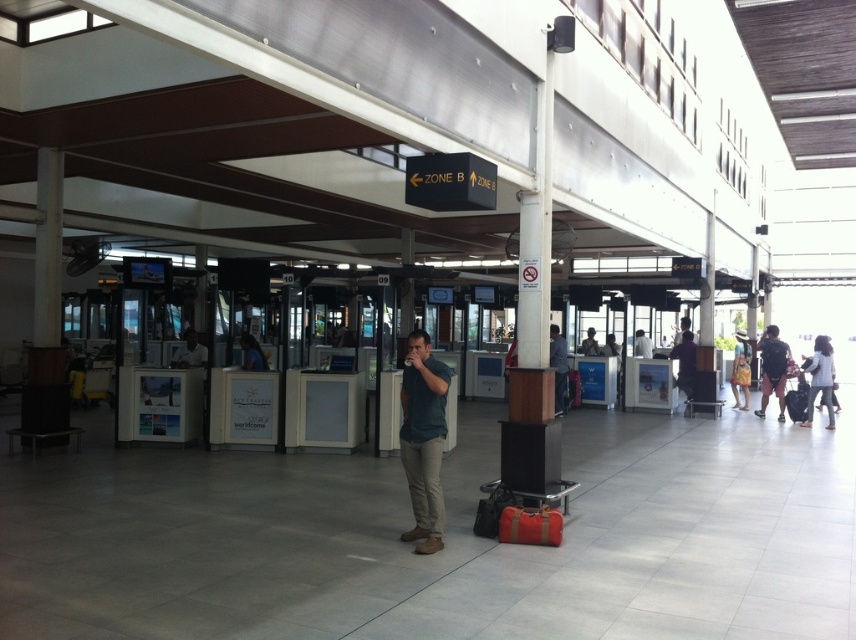
Question: Can you confirm if dark purple shirt at center is positioned above white fabric shirt at center?

Choices:
 (A) yes
 (B) no

Answer: (B)

Question: Which object appears closest to the camera in this image?

Choices:
 (A) light blue shirt at center
 (B) white cotton shirt at right

Answer: (B)

Question: Which of the following is the farthest from the observer?

Choices:
 (A) matte black suitcase at center
 (B) white shirt at center

Answer: (A)

Question: Based on their relative distances, which object is farther from the light brown leather jacket at center?

Choices:
 (A) dark gray shirt at center
 (B) blue fabric shirt at center

Answer: (B)

Question: Can you confirm if green matte shirt at center is positioned to the left of blue fabric shirt at center?

Choices:
 (A) no
 (B) yes

Answer: (A)

Question: Does dark blue jeans at right have a greater width compared to light blue shirt at center?

Choices:
 (A) no
 (B) yes

Answer: (B)